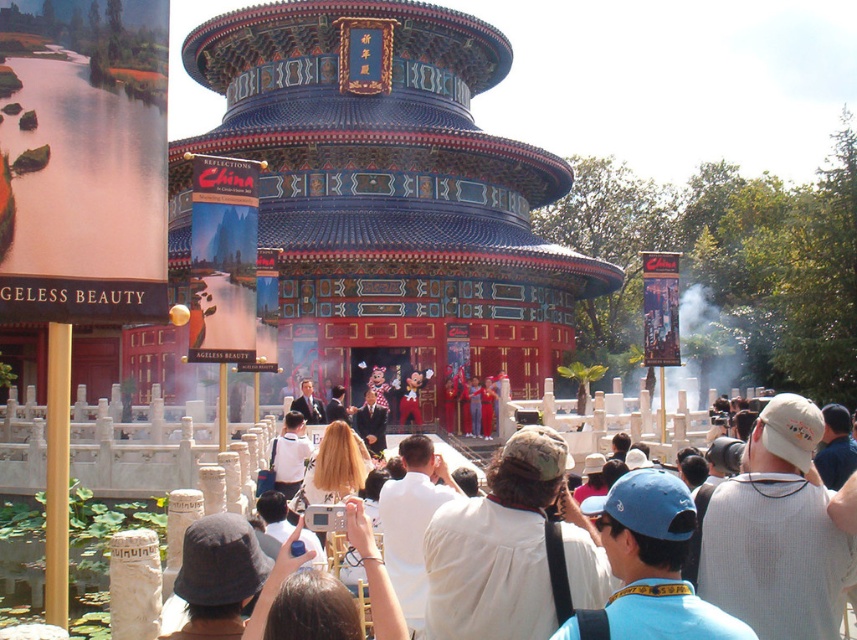
Who is more forward, (718,570) or (342,636)?

Point (342,636)

Between white knit cap at center and white plastic camera at center, which one is positioned lower?

white plastic camera at center

I want to click on white knit cap at center, so click(x=777, y=532).

Identify the location of white knit cap at center. The width and height of the screenshot is (857, 640). (777, 532).

Which is in front, point (734, 540) or point (742, 630)?

Positioned in front is point (742, 630).

Between white knit cap at center and blue fabric cap at center, which one has more height?

Standing taller between the two is white knit cap at center.

Find the location of a particular element. white knit cap at center is located at coordinates (777, 532).

Is white cotton crowd at center in front of white plastic camera at center?

No, it is behind white plastic camera at center.

What do you see at coordinates (777, 534) in the screenshot?
I see `white cotton crowd at center` at bounding box center [777, 534].

Which is in front, point (838, 612) or point (285, 545)?

Point (285, 545)

You are a GUI agent. You are given a task and a screenshot of the screen. Output one action in this format:
    pyautogui.click(x=<x>, y=<y>)
    Task: Click on the white cotton crowd at center
    
    Given the screenshot: What is the action you would take?
    pyautogui.click(x=777, y=534)